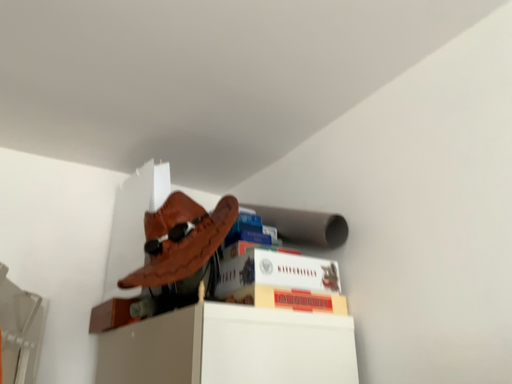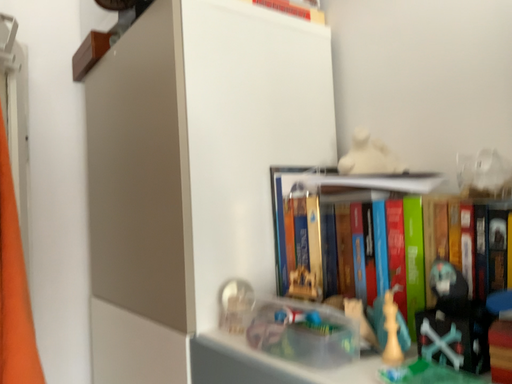
Question: How did the camera likely rotate when shooting the video?

Choices:
 (A) rotated downward
 (B) rotated upward

Answer: (A)